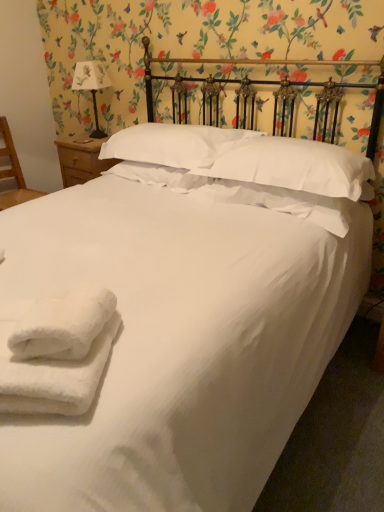
Question: Can you confirm if white textured pillow at center, positioned as the 2th pillow in right-to-left order, is bigger than white fluffy towels at lower left?

Choices:
 (A) yes
 (B) no

Answer: (A)

Question: From a real-world perspective, is white textured pillow at center, the 2th pillow when ordered from left to right, beneath white fluffy towels at lower left?

Choices:
 (A) no
 (B) yes

Answer: (B)

Question: Is white textured pillow at center, the 2th pillow when ordered from left to right, closer to the viewer compared to white fluffy towels at lower left?

Choices:
 (A) yes
 (B) no

Answer: (B)

Question: Can you see white textured pillow at center, the 2th pillow when ordered from left to right, touching white fluffy towels at lower left?

Choices:
 (A) no
 (B) yes

Answer: (A)

Question: Is white textured pillow at center, the 2th pillow when ordered from left to right, shorter than white fluffy towels at lower left?

Choices:
 (A) no
 (B) yes

Answer: (B)

Question: Would you say white fluffy towels at lower left is part of white textured pillow at center, the 2th pillow when ordered from left to right,'s contents?

Choices:
 (A) no
 (B) yes

Answer: (A)

Question: Does white fluffy towels at lower left appear on the right side of white soft pillow at upper center, which is the first pillow from right to left?

Choices:
 (A) no
 (B) yes

Answer: (A)

Question: From a real-world perspective, is white fluffy towels at lower left physically below white soft pillow at upper center, positioned as the third pillow in left-to-right order?

Choices:
 (A) no
 (B) yes

Answer: (B)

Question: Is white fluffy towels at lower left aimed at white soft pillow at upper center, which is the first pillow from right to left?

Choices:
 (A) yes
 (B) no

Answer: (B)

Question: Is white fluffy towels at lower left wider than white soft pillow at upper center, positioned as the third pillow in left-to-right order?

Choices:
 (A) no
 (B) yes

Answer: (A)

Question: Is white fluffy towels at lower left bigger than white soft pillow at upper center, positioned as the third pillow in left-to-right order?

Choices:
 (A) yes
 (B) no

Answer: (B)

Question: Is white soft pillow at upper center, positioned as the third pillow in left-to-right order, completely or partially inside white fluffy towels at lower left?

Choices:
 (A) no
 (B) yes

Answer: (A)

Question: Is wooden chair at left a part of white fluffy towels at lower left?

Choices:
 (A) yes
 (B) no

Answer: (B)